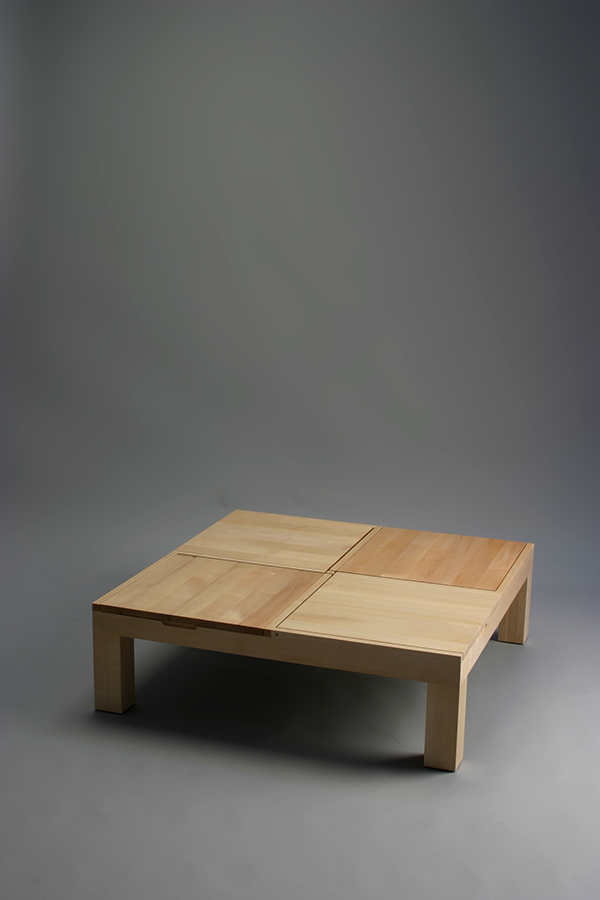
Where is `base wood layer`? base wood layer is located at coordinates (284, 649).